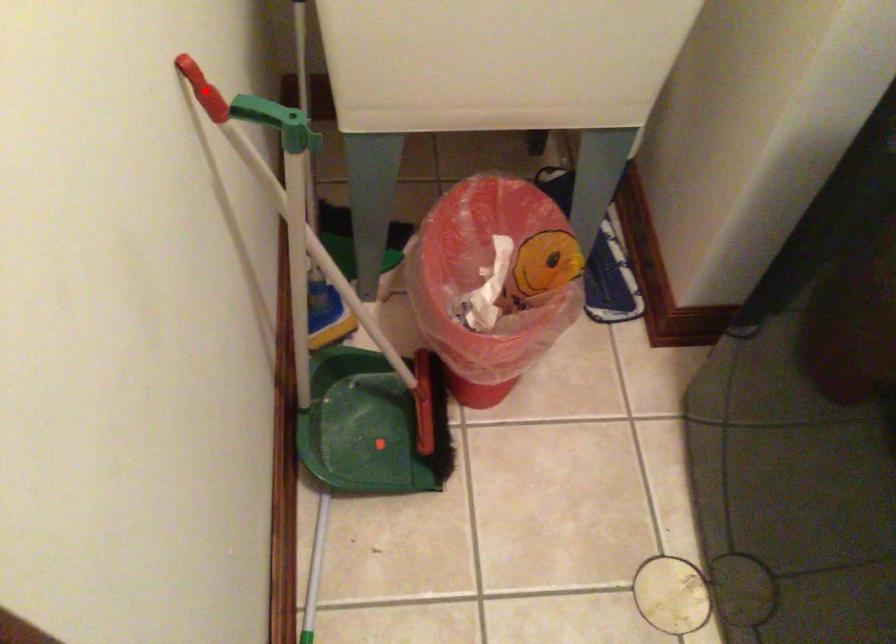
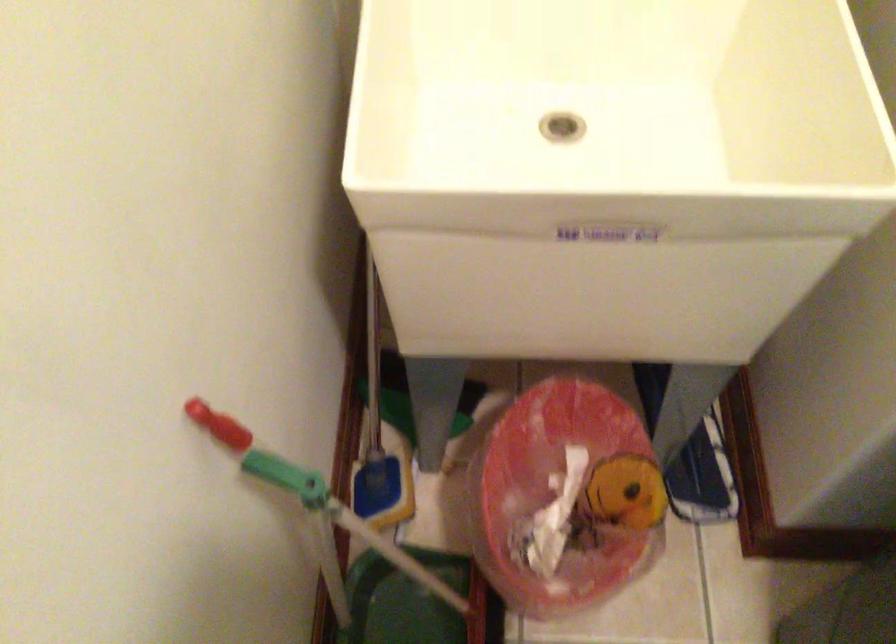
The point at the highlighted location is marked in the first image. Where is the corresponding point in the second image?

(220, 426)